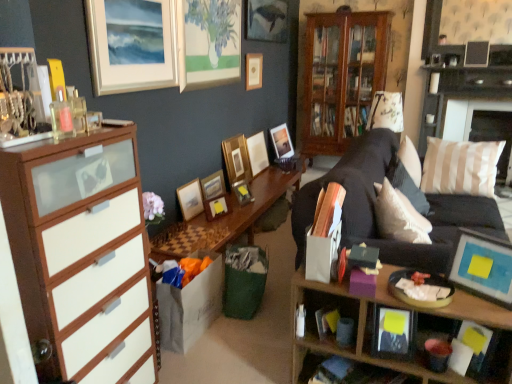
Question: Considering the relative sizes of wooden cabinet at center and wooden picture frame at center, which appears as the fifth picture frame when viewed from the front, in the image provided, is wooden cabinet at center thinner than wooden picture frame at center, which appears as the fifth picture frame when viewed from the front,?

Choices:
 (A) no
 (B) yes

Answer: (A)

Question: From a real-world perspective, is wooden cabinet at center under wooden picture frame at center, which appears as the fifth picture frame when viewed from the front?

Choices:
 (A) no
 (B) yes

Answer: (A)

Question: Is wooden cabinet at center aimed at wooden picture frame at center, the 7th picture frame in the back-to-front sequence?

Choices:
 (A) yes
 (B) no

Answer: (A)

Question: Are wooden cabinet at center and wooden picture frame at center, the 7th picture frame in the back-to-front sequence, located far from each other?

Choices:
 (A) yes
 (B) no

Answer: (A)

Question: Can you confirm if wooden cabinet at center is wider than wooden picture frame at center, which appears as the fifth picture frame when viewed from the front?

Choices:
 (A) yes
 (B) no

Answer: (A)

Question: Does wooden cabinet at center appear on the right side of wooden picture frame at center, which appears as the fifth picture frame when viewed from the front?

Choices:
 (A) no
 (B) yes

Answer: (B)

Question: Is wooden picture frame at center, the eighth picture frame viewed from the back, positioned behind wooden cabinet at center?

Choices:
 (A) yes
 (B) no

Answer: (B)

Question: Is wooden cabinet at center at the back of wooden picture frame at center, which is the 4th picture frame from front to back?

Choices:
 (A) yes
 (B) no

Answer: (B)

Question: Does wooden picture frame at center, which is the 4th picture frame from front to back, appear on the right side of wooden cabinet at center?

Choices:
 (A) no
 (B) yes

Answer: (A)

Question: Would you say wooden picture frame at center, which is the 4th picture frame from front to back, contains wooden cabinet at center?

Choices:
 (A) yes
 (B) no

Answer: (B)

Question: Considering the relative sizes of wooden picture frame at center, which is the 4th picture frame from front to back, and wooden cabinet at center in the image provided, is wooden picture frame at center, which is the 4th picture frame from front to back, taller than wooden cabinet at center?

Choices:
 (A) no
 (B) yes

Answer: (A)

Question: Would you say wooden picture frame at center, the eighth picture frame viewed from the back, is outside wooden cabinet at center?

Choices:
 (A) no
 (B) yes

Answer: (B)

Question: Could you tell me if wooden picture frame at upper center, which ranks as the 3th picture frame in back-to-front order, is facing matte wooden picture frame at upper center, which ranks as the first picture frame in back-to-front order?

Choices:
 (A) yes
 (B) no

Answer: (B)